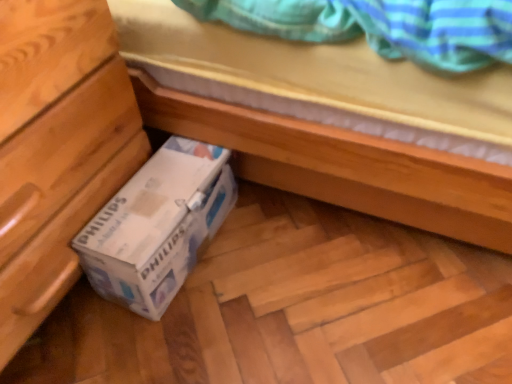
Question: Is wooden chest of drawers at lower left bigger than white cardboard box at lower left?

Choices:
 (A) yes
 (B) no

Answer: (A)

Question: Is wooden chest of drawers at lower left facing towards white cardboard box at lower left?

Choices:
 (A) yes
 (B) no

Answer: (A)

Question: From the image's perspective, would you say wooden chest of drawers at lower left is positioned over white cardboard box at lower left?

Choices:
 (A) no
 (B) yes

Answer: (B)

Question: Is wooden chest of drawers at lower left positioned with its back to white cardboard box at lower left?

Choices:
 (A) yes
 (B) no

Answer: (B)

Question: Considering the relative positions of wooden chest of drawers at lower left and white cardboard box at lower left in the image provided, is wooden chest of drawers at lower left behind white cardboard box at lower left?

Choices:
 (A) no
 (B) yes

Answer: (A)

Question: From a real-world perspective, is wooden chest of drawers at lower left located beneath white cardboard box at lower left?

Choices:
 (A) yes
 (B) no

Answer: (B)

Question: Is white cardboard box at lower left thinner than wooden chest of drawers at lower left?

Choices:
 (A) no
 (B) yes

Answer: (B)

Question: Is white cardboard box at lower left located outside wooden chest of drawers at lower left?

Choices:
 (A) no
 (B) yes

Answer: (B)

Question: Can you see white cardboard box at lower left touching wooden chest of drawers at lower left?

Choices:
 (A) yes
 (B) no

Answer: (B)

Question: Does white cardboard box at lower left have a lesser height compared to wooden chest of drawers at lower left?

Choices:
 (A) yes
 (B) no

Answer: (A)

Question: From a real-world perspective, is white cardboard box at lower left located beneath wooden chest of drawers at lower left?

Choices:
 (A) no
 (B) yes

Answer: (B)

Question: Is white cardboard box at lower left wider than wooden chest of drawers at lower left?

Choices:
 (A) yes
 (B) no

Answer: (B)

Question: Considering the positions of wooden chest of drawers at lower left and white cardboard box at lower left in the image, is wooden chest of drawers at lower left wider or thinner than white cardboard box at lower left?

Choices:
 (A) thin
 (B) wide

Answer: (B)